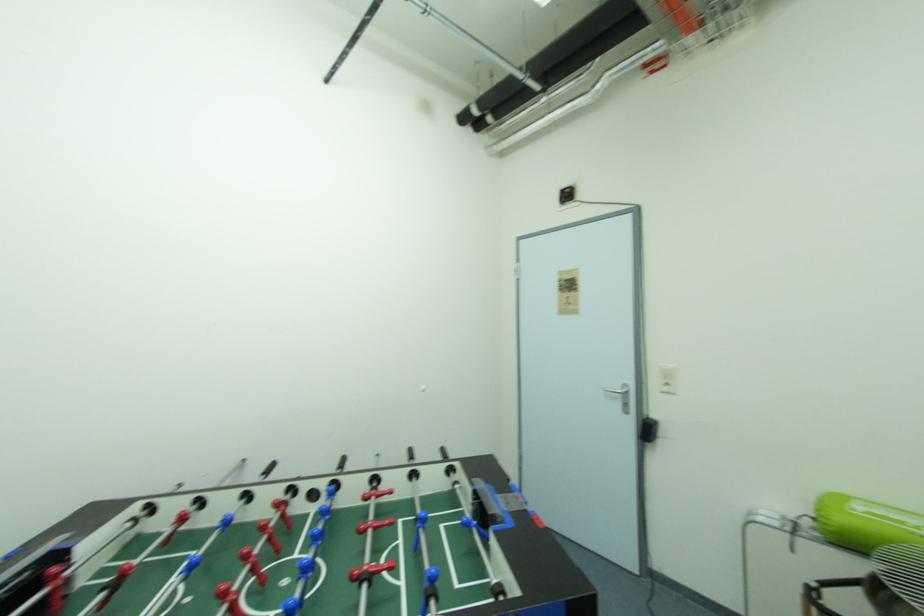
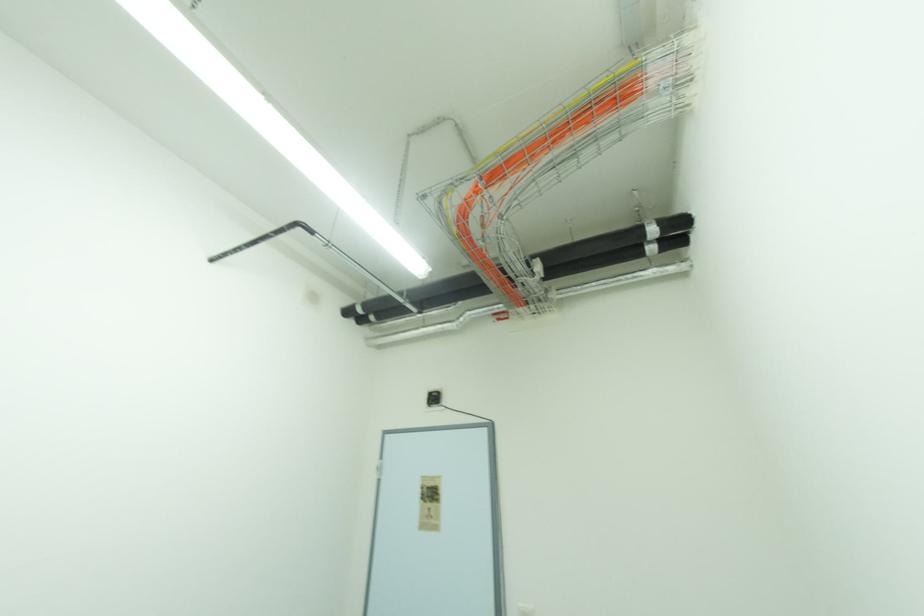
How did the camera likely rotate?

The rotation direction of the camera is right-up.